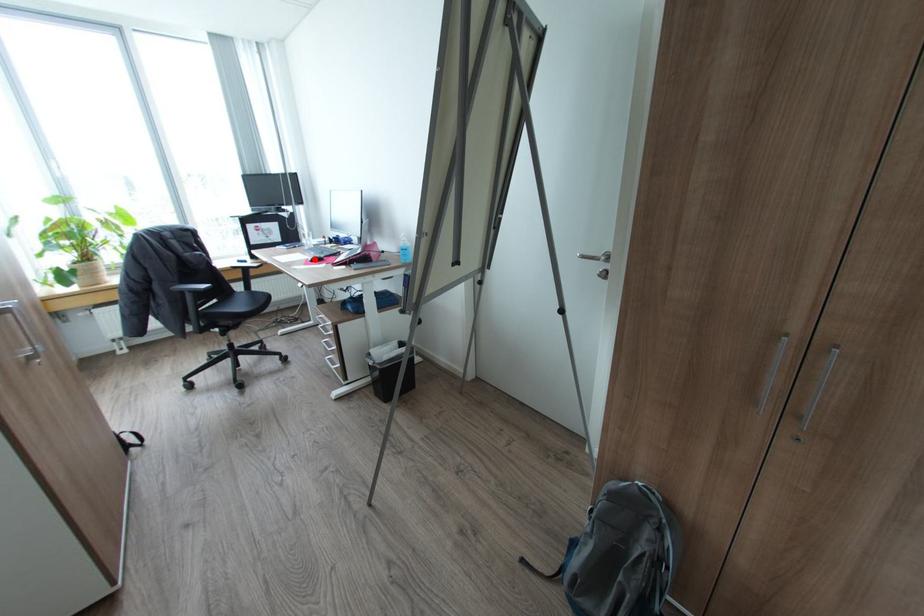
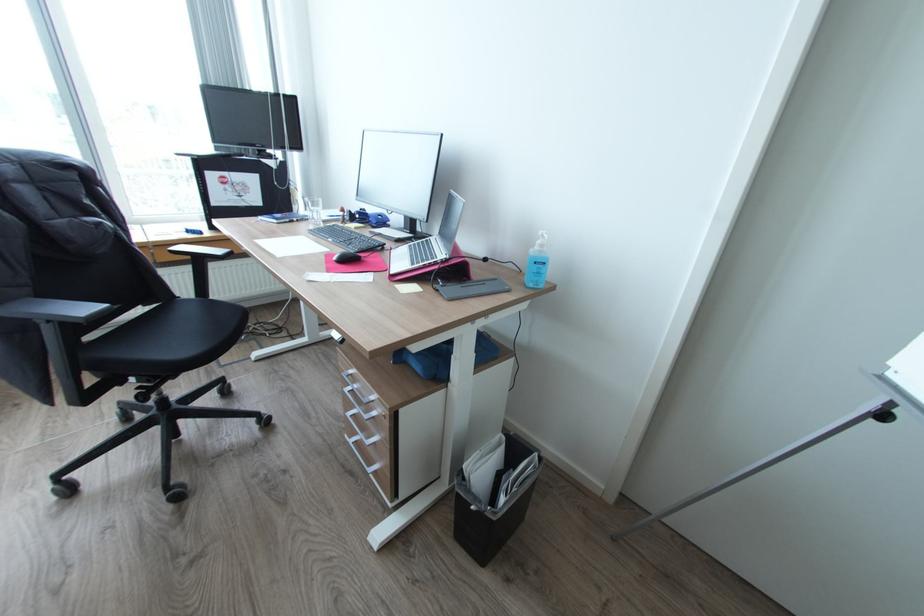
Locate, in the second image, the point that corresponds to the highlighted location in the first image.

(339, 257)